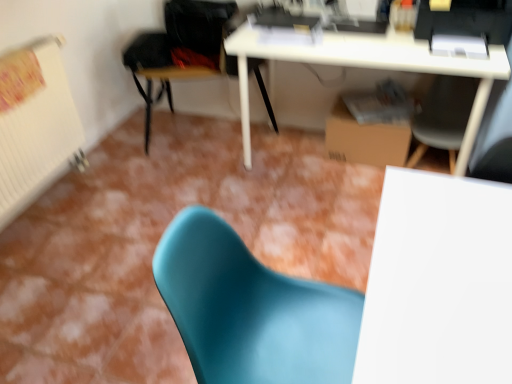
Identify the location of black leather chair at center, arranged as the third chair when viewed from the front. The image size is (512, 384). (182, 48).

Find the location of `matte gray chair at center, which is the 2th chair in back-to-front order`. matte gray chair at center, which is the 2th chair in back-to-front order is located at coordinates (443, 117).

The width and height of the screenshot is (512, 384). Identify the location of white matte table at center. (438, 283).

The image size is (512, 384). What do you see at coordinates (438, 283) in the screenshot?
I see `white matte table at center` at bounding box center [438, 283].

Locate an element on the screen. The image size is (512, 384). matte teal chair at lower center, which is the 2th chair from right to left is located at coordinates (251, 310).

Is black leather chair at center, acting as the 3th chair starting from the right, smaller than brown cardboard box at lower right?

Incorrect, black leather chair at center, acting as the 3th chair starting from the right, is not smaller in size than brown cardboard box at lower right.

Is black leather chair at center, placed as the 1th chair when sorted from back to front, oriented away from brown cardboard box at lower right?

black leather chair at center, placed as the 1th chair when sorted from back to front, is not turned away from brown cardboard box at lower right.

Considering the points (197, 59) and (364, 157), which point is in front, point (197, 59) or point (364, 157)?

Positioned in front is point (364, 157).

Which is more to the right, black leather chair at center, arranged as the first chair when viewed from the left, or brown cardboard box at lower right?

brown cardboard box at lower right.

How many degrees apart are the facing directions of matte teal chair at lower center, which is the 2th chair from right to left, and white glossy desk at upper center?

90 degrees.

Between matte teal chair at lower center, acting as the 2th chair starting from the left, and white glossy desk at upper center, which one is positioned behind?

white glossy desk at upper center.

Considering the positions of objects matte teal chair at lower center, which is the 2th chair from right to left, and white glossy desk at upper center in the image provided, who is more to the left, matte teal chair at lower center, which is the 2th chair from right to left, or white glossy desk at upper center?

matte teal chair at lower center, which is the 2th chair from right to left.

Is matte teal chair at lower center, the first chair positioned from the front, positioned with its back to white glossy desk at upper center?

No, matte teal chair at lower center, the first chair positioned from the front, is not facing away from white glossy desk at upper center.

Which object is closer to the camera, black leather chair at center, placed as the 1th chair when sorted from back to front, or white matte table at center?

white matte table at center is more forward.

Is there a large distance between black leather chair at center, arranged as the third chair when viewed from the front, and white matte table at center?

Yes.

What's the angular difference between black leather chair at center, acting as the 3th chair starting from the right, and white matte table at center's facing directions?

There is a 4.09-degree angle between the facing directions of black leather chair at center, acting as the 3th chair starting from the right, and white matte table at center.

From the image's perspective, is black leather chair at center, arranged as the third chair when viewed from the front, located above or below white matte table at center?

From the image's perspective, black leather chair at center, arranged as the third chair when viewed from the front, appears above white matte table at center.

From a real-world perspective, which is physically below, matte teal chair at lower center, the first chair positioned from the front, or matte gray chair at center, which is the second chair in front-to-back order?

matte gray chair at center, which is the second chair in front-to-back order.

Which object is wider, matte teal chair at lower center, the first chair positioned from the front, or matte gray chair at center, marked as the 3th chair in a left-to-right arrangement?

Wider between the two is matte teal chair at lower center, the first chair positioned from the front.

Is matte teal chair at lower center, acting as the 2th chair starting from the left, to the right of matte gray chair at center, which is the 2th chair in back-to-front order, from the viewer's perspective?

Incorrect, matte teal chair at lower center, acting as the 2th chair starting from the left, is not on the right side of matte gray chair at center, which is the 2th chair in back-to-front order.

Considering the relative sizes of matte teal chair at lower center, acting as the 2th chair starting from the left, and matte gray chair at center, which is the second chair in front-to-back order, in the image provided, is matte teal chair at lower center, acting as the 2th chair starting from the left, smaller than matte gray chair at center, which is the second chair in front-to-back order,?

No, matte teal chair at lower center, acting as the 2th chair starting from the left, is not smaller than matte gray chair at center, which is the second chair in front-to-back order.

Is there a large distance between matte gray chair at center, which is the second chair in front-to-back order, and matte teal chair at lower center, the 3th chair when ordered from back to front?

Yes, matte gray chair at center, which is the second chair in front-to-back order, is far from matte teal chair at lower center, the 3th chair when ordered from back to front.

Considering the points (434, 110) and (228, 314), which point is behind, point (434, 110) or point (228, 314)?

Positioned behind is point (434, 110).

Is matte gray chair at center, which is the 2th chair in back-to-front order, spatially inside matte teal chair at lower center, the 3th chair when ordered from back to front, or outside of it?

matte gray chair at center, which is the 2th chair in back-to-front order, is not enclosed by matte teal chair at lower center, the 3th chair when ordered from back to front.

Can you tell me how much matte gray chair at center, positioned as the first chair in right-to-left order, and matte teal chair at lower center, the 3th chair when ordered from back to front, differ in facing direction?

The angular difference between matte gray chair at center, positioned as the first chair in right-to-left order, and matte teal chair at lower center, the 3th chair when ordered from back to front, is 91.1 degrees.

Considering the sizes of objects brown cardboard box at lower right and matte gray chair at center, which is the 2th chair in back-to-front order, in the image provided, who is taller, brown cardboard box at lower right or matte gray chair at center, which is the 2th chair in back-to-front order,?

matte gray chair at center, which is the 2th chair in back-to-front order.

Is brown cardboard box at lower right facing towards matte gray chair at center, positioned as the first chair in right-to-left order?

No, brown cardboard box at lower right is not oriented towards matte gray chair at center, positioned as the first chair in right-to-left order.

Looking at the image, does brown cardboard box at lower right seem bigger or smaller compared to matte gray chair at center, which is the second chair in front-to-back order?

Clearly, brown cardboard box at lower right is smaller in size than matte gray chair at center, which is the second chair in front-to-back order.

Which object is more forward, brown cardboard box at lower right or matte gray chair at center, which is the 2th chair in back-to-front order?

matte gray chair at center, which is the 2th chair in back-to-front order, is in front.

From the picture: From the image's perspective, which one is positioned higher, brown cardboard box at lower right or matte teal chair at lower center, which is the 2th chair from right to left?

brown cardboard box at lower right.

Based on the photo, which of these two, brown cardboard box at lower right or matte teal chair at lower center, acting as the 2th chair starting from the left, is thinner?

brown cardboard box at lower right is thinner.

Can you confirm if brown cardboard box at lower right is positioned to the left of matte teal chair at lower center, acting as the 2th chair starting from the left?

No.

From a real-world perspective, is brown cardboard box at lower right beneath matte teal chair at lower center, the first chair positioned from the front?

Yes.

Starting from the brown cardboard box at lower right, which chair is the 1st one in front? Please provide its 2D coordinates.

[(182, 48)]

Where is `desk located underneath the matte teal chair at lower center, the first chair positioned from the front (from a real-world perspective)`? The width and height of the screenshot is (512, 384). desk located underneath the matte teal chair at lower center, the first chair positioned from the front (from a real-world perspective) is located at coordinates (370, 67).

Looking at this image, from the image, which object appears to be farther from brown cardboard box at lower right, matte gray chair at center, marked as the 3th chair in a left-to-right arrangement, or white matte table at center?

white matte table at center.

From the image, which object appears to be nearer to white glossy desk at upper center, brown cardboard box at lower right or black leather chair at center, arranged as the first chair when viewed from the left?

brown cardboard box at lower right lies closer to white glossy desk at upper center than the other object.

Looking at the image, which one is located further to brown cardboard box at lower right, matte teal chair at lower center, acting as the 2th chair starting from the left, or white matte table at center?

Among the two, matte teal chair at lower center, acting as the 2th chair starting from the left, is located further to brown cardboard box at lower right.

Based on their spatial positions, is white matte table at center or white glossy desk at upper center further from matte teal chair at lower center, the 3th chair when ordered from back to front?

white glossy desk at upper center is further to matte teal chair at lower center, the 3th chair when ordered from back to front.

Based on their spatial positions, is brown cardboard box at lower right or white matte table at center closer to white glossy desk at upper center?

brown cardboard box at lower right.

Considering their positions, is brown cardboard box at lower right positioned further to matte gray chair at center, which is the second chair in front-to-back order, than white matte table at center?

white matte table at center is further to matte gray chair at center, which is the second chair in front-to-back order.

Based on the photo, based on their spatial positions, is black leather chair at center, placed as the 1th chair when sorted from back to front, or brown cardboard box at lower right closer to matte teal chair at lower center, acting as the 2th chair starting from the left?

brown cardboard box at lower right lies closer to matte teal chair at lower center, acting as the 2th chair starting from the left, than the other object.

Considering their positions, is white glossy desk at upper center positioned further to black leather chair at center, acting as the 3th chair starting from the right, than white matte table at center?

white matte table at center lies further to black leather chair at center, acting as the 3th chair starting from the right, than the other object.

Identify the location of table positioned between matte teal chair at lower center, acting as the 2th chair starting from the left, and matte gray chair at center, which is the 2th chair in back-to-front order, from near to far. (438, 283).

This screenshot has height=384, width=512. I want to click on desk between matte teal chair at lower center, which is the 2th chair from right to left, and brown cardboard box at lower right, along the z-axis, so click(370, 67).

At what (x,y) coordinates should I click in order to perform the action: click on desk between white matte table at center and matte gray chair at center, which is the 2th chair in back-to-front order, along the z-axis. Please return your answer as a coordinate pair (x, y). Looking at the image, I should click on [370, 67].

You are a GUI agent. You are given a task and a screenshot of the screen. Output one action in this format:
    pyautogui.click(x=<x>, y=<y>)
    Task: Click on the table positioned between matte teal chair at lower center, acting as the 2th chair starting from the left, and black leather chair at center, arranged as the third chair when viewed from the front, from near to far
    
    Given the screenshot: What is the action you would take?
    pyautogui.click(x=438, y=283)